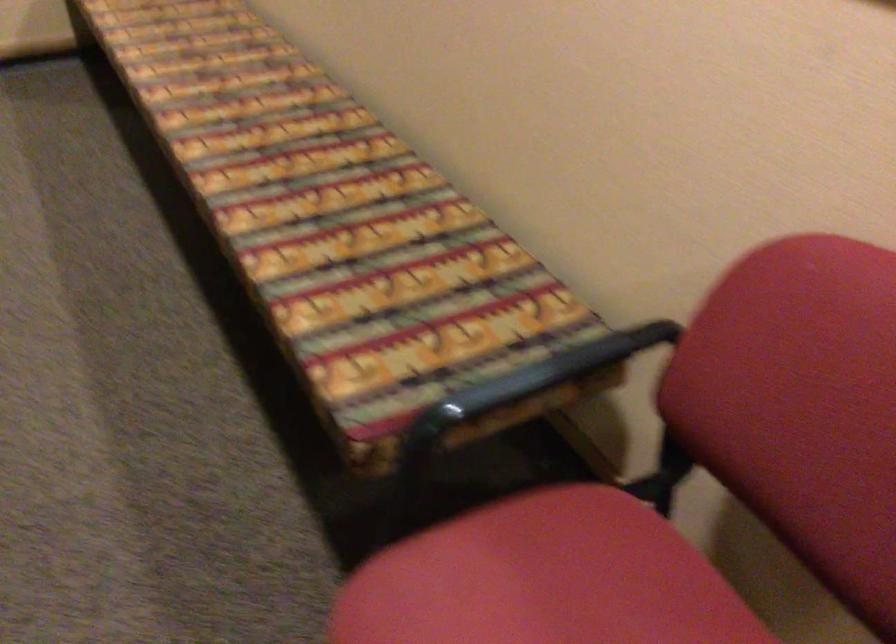
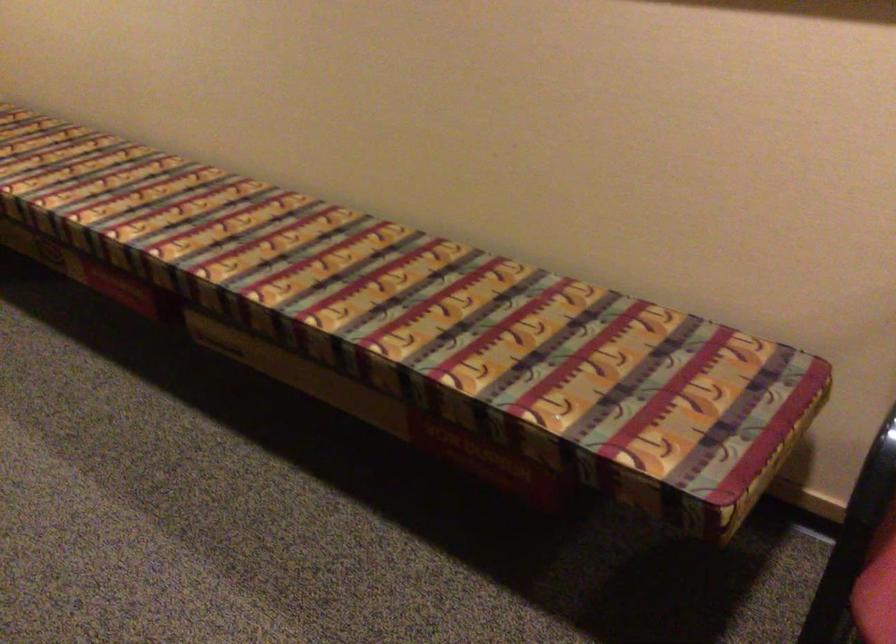
Locate, in the second image, the point that corresponds to the point at 308,205 in the first image.

(426, 315)